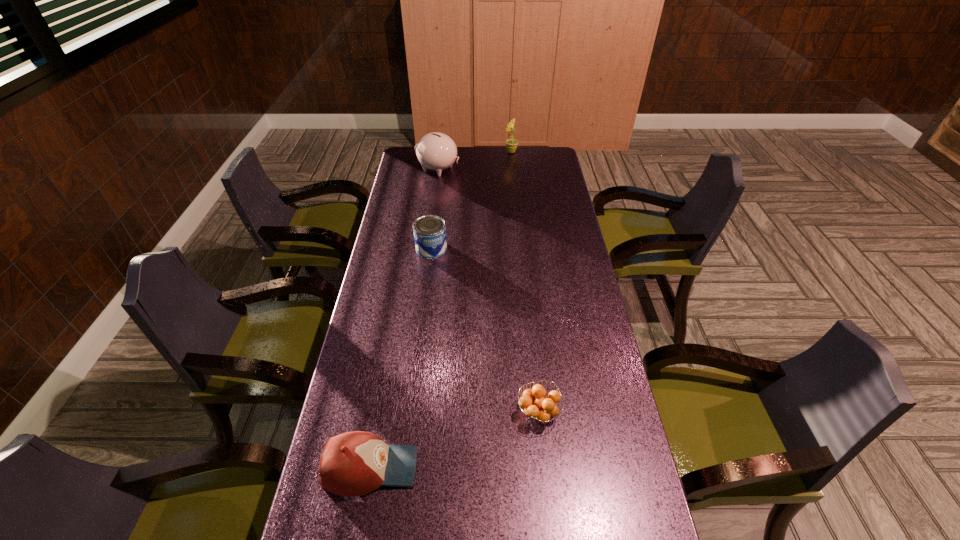
Locate an element on the screen. The height and width of the screenshot is (540, 960). vacant area at the far edge is located at coordinates (504, 152).

This screenshot has width=960, height=540. Find the location of `vacant space at the left edge`. vacant space at the left edge is located at coordinates (399, 391).

Where is `free space at the right edge of the desktop`? The height and width of the screenshot is (540, 960). free space at the right edge of the desktop is located at coordinates (595, 444).

Find the location of a particular element. This screenshot has width=960, height=540. free spot between the third nearest object and the shortest object is located at coordinates (485, 330).

Identify the location of unoccupied position between the nearest object and the fourth farthest object. (455, 440).

Find the location of a particular element. This screenshot has width=960, height=540. free area in between the second nearest object and the can is located at coordinates (485, 330).

At what (x,y) coordinates should I click in order to perform the action: click on empty location between the sunflower and the shortest object. Please return your answer as a coordinate pair (x, y). This screenshot has width=960, height=540. Looking at the image, I should click on (525, 282).

This screenshot has width=960, height=540. I want to click on vacant area that lies between the third nearest object and the orange fruit, so click(485, 330).

Image resolution: width=960 pixels, height=540 pixels. In order to click on blank region between the third farthest object and the farthest object in this screenshot , I will do `click(471, 200)`.

Identify the location of vacant area that lies between the farthest object and the nearest object. (441, 309).